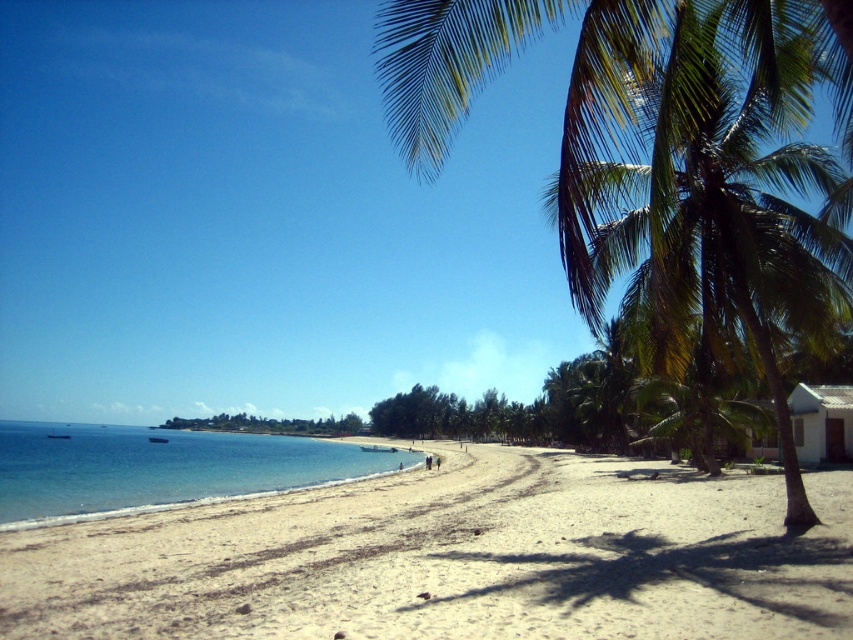
You are standing on the beach and want to take a photo of the white matte hut at lower right without the green leafy palm tree at right blocking the view. How should you position yourself?

Move to the left side of the white matte hut at lower right so that the green leafy palm tree at right is out of frame.

Looking at this image, you are standing at the center of the beach and want to take a photo of the green leafy palm tree at right. Which direction should you face to capture it in your camera?

The green leafy palm tree at right is located at coordinates point (663, 154), so you should face towards the right side of the beach to capture it in your camera.

In the scene shown: You are standing on the beach and want to take a photo of both the green leafy palm tree at right and the white matte hut at lower right in the same frame. Given that your camera has a 50mm lens, which has a field of view of about 46 degrees, can you fit both objects into the frame without moving closer or further away?

The green leafy palm tree at right is 132.15 feet away from the white matte hut at lower right. To determine if they can fit in the frame, we need to calculate the angular separation between them. However, without knowing their exact positions relative to the camera or the distance from the camera to the objects, it is impossible to accurately determine if they can both fit within the 46 degree field of view. Additional information about their placement from the photographer is required for an accurate yes.